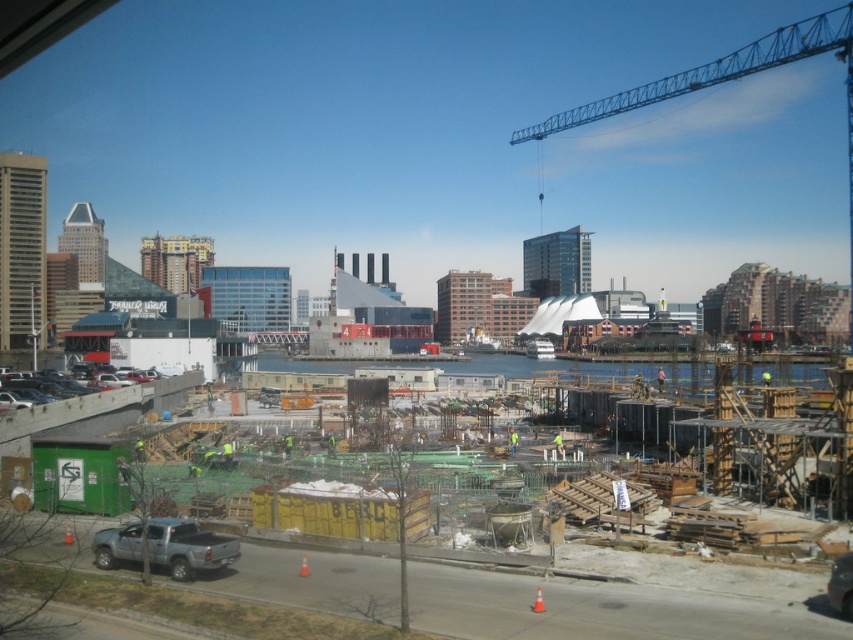
You are standing at the point labeled point [727,80] in the image. Which object are you currently on?

You are currently on the blue metallic crane at upper right.

You are standing at the camera position observing the construction site. There is a point marked at coordinates point (814, 17). Can you safely walk to that point without crossing any dangerous areas?

The point (814, 17) is 466.83 meters away from the camera position. Since the construction site is described as bustling with active work, materials, and equipment, walking 466 meters through such an area poses significant risks from machinery, falling objects, and uneven terrain. Therefore, it is not safe to attempt walking to that point without proper safety measures and authorization.